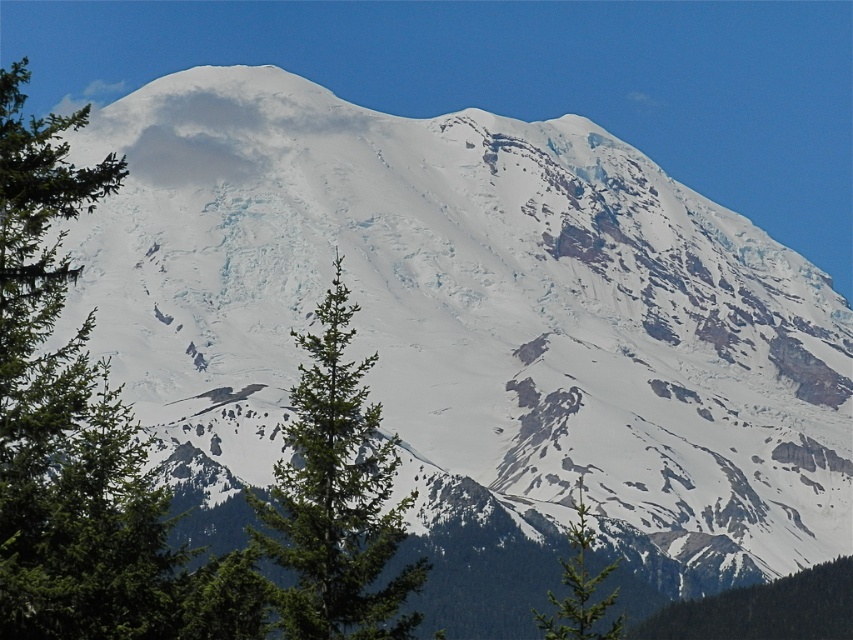
Question: Is green textured pine tree at left further to the viewer compared to green matte tree at lower right?

Choices:
 (A) yes
 (B) no

Answer: (B)

Question: Is green needle-like tree at center further to camera compared to green textured pine tree at center?

Choices:
 (A) yes
 (B) no

Answer: (B)

Question: Which point appears closest to the camera in this image?

Choices:
 (A) (26, 602)
 (B) (331, 404)
 (C) (589, 538)

Answer: (A)

Question: Which object is positioned farthest from the green textured pine tree at center?

Choices:
 (A) green textured pine tree at left
 (B) green needle-like tree at center
 (C) green matte tree at lower right

Answer: (A)

Question: Which object is farther from the camera taking this photo?

Choices:
 (A) green textured pine tree at left
 (B) green needle-like tree at center

Answer: (B)

Question: Is green textured pine tree at left positioned in front of green textured pine tree at center?

Choices:
 (A) yes
 (B) no

Answer: (A)